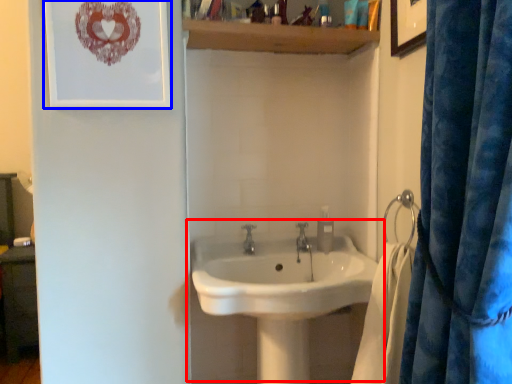
Question: Which point is closer to the camera, sink (highlighted by a red box) or picture frame (highlighted by a blue box)?

Choices:
 (A) sink
 (B) picture frame

Answer: (A)